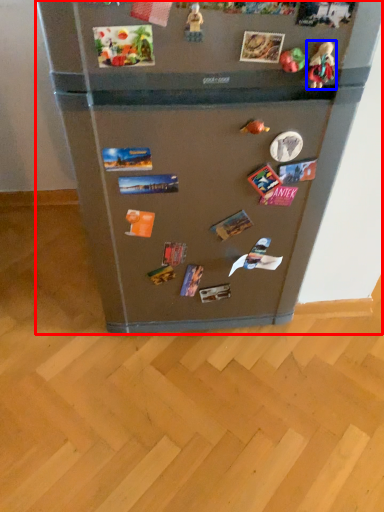
Question: Which object is further to the camera taking this photo, refrigerator (highlighted by a red box) or toy (highlighted by a blue box)?

Choices:
 (A) refrigerator
 (B) toy

Answer: (B)